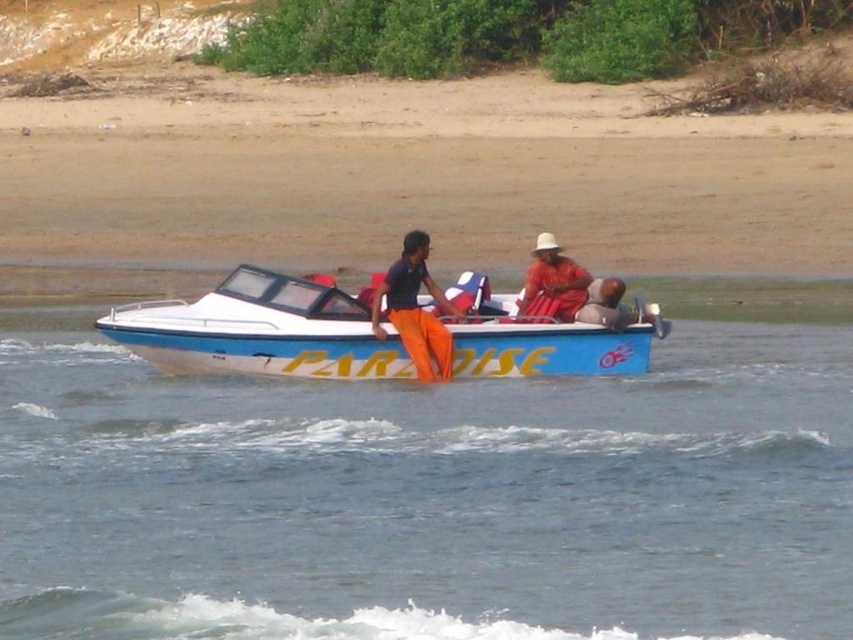
Question: Which point is closer to the camera?

Choices:
 (A) blue plastic boat at center
 (B) blue glossy boat at center

Answer: (A)

Question: Which point appears farthest from the camera in this image?

Choices:
 (A) (247, 337)
 (B) (750, 580)

Answer: (A)

Question: Does orange matte pants at center appear over orange fabric at center?

Choices:
 (A) yes
 (B) no

Answer: (B)

Question: Which object is closer to the camera taking this photo?

Choices:
 (A) blue glossy boat at center
 (B) blue plastic boat at center
 (C) orange matte pants at center

Answer: (B)

Question: Does blue plastic boat at center have a greater width compared to orange matte pants at center?

Choices:
 (A) yes
 (B) no

Answer: (A)

Question: Is blue plastic boat at center above blue glossy boat at center?

Choices:
 (A) yes
 (B) no

Answer: (B)